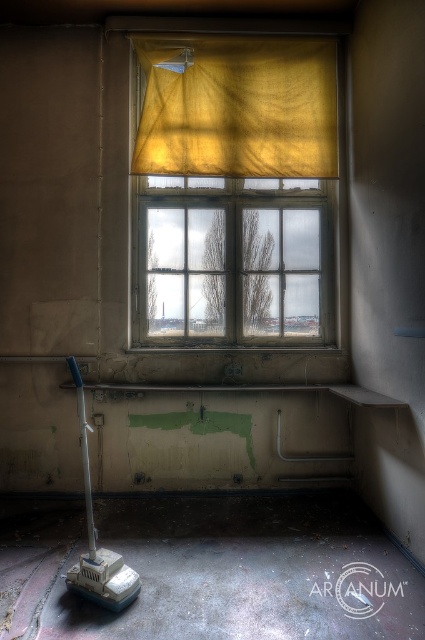
You are an interior designer assessing the room. You notice the yellow fabric at center and the yellow sheer curtain at upper center. Which object is taller in the scene?

The yellow fabric at center is much taller than the yellow sheer curtain at upper center.

You are standing in the abandoned room and want to place a small potted plant between the two points, point (x=158, y=140) and point (x=305, y=390). To ensure it is visible from where you are standing, which point should you place it closer to?

You should place the potted plant closer to point (x=158, y=140) because it is closer to you than point (x=305, y=390), making it more visible from your current position.

You are standing in the abandoned room and want to place a small potted plant on the nearest surface. Which object should you choose between the yellow fabric at center and the smooth concrete ledge at lower center?

The yellow fabric at center is further to the viewer than the smooth concrete ledge at lower center, so the smooth concrete ledge at lower center is closer and the best option for placing the plant.